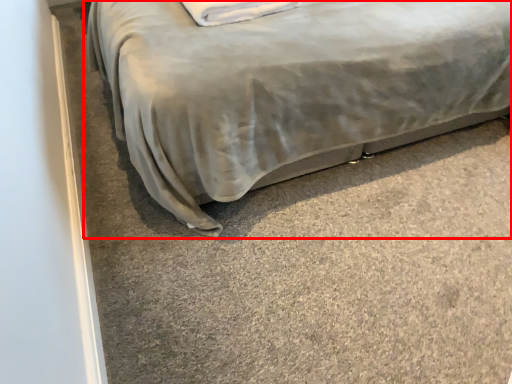
Question: From the image, what is the correct spatial relationship of bed (annotated by the red box) in relation to pillow?

Choices:
 (A) left
 (B) right

Answer: (B)